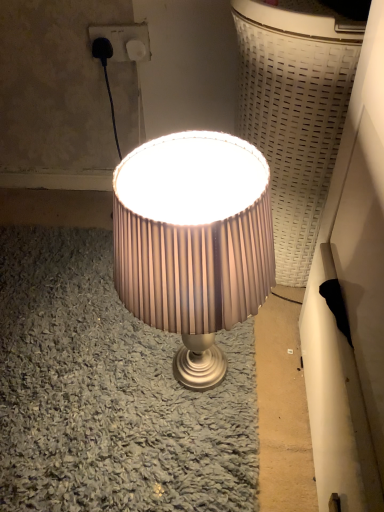
The height and width of the screenshot is (512, 384). What do you see at coordinates (124, 41) in the screenshot? I see `white plastic socket at upper center` at bounding box center [124, 41].

Locate an element on the screen. This screenshot has height=512, width=384. white plastic socket at upper center is located at coordinates (124, 41).

Identify the location of matte beige lampshade at center. The width and height of the screenshot is (384, 512). (193, 242).

This screenshot has height=512, width=384. Describe the element at coordinates (193, 242) in the screenshot. I see `matte beige lampshade at center` at that location.

What are the coordinates of `white plastic socket at upper center` in the screenshot? It's located at (124, 41).

Does white plastic socket at upper center appear on the left side of matte beige lampshade at center?

Indeed, white plastic socket at upper center is positioned on the left side of matte beige lampshade at center.

Which object is further away from the camera, white plastic socket at upper center or matte beige lampshade at center?

white plastic socket at upper center is further from the camera.

Considering the positions of point (130, 51) and point (244, 227), is point (130, 51) closer or farther from the camera than point (244, 227)?

Point (130, 51) is positioned farther from the camera compared to point (244, 227).

From the image's perspective, relative to matte beige lampshade at center, is white plastic socket at upper center above or below?

white plastic socket at upper center is situated higher than matte beige lampshade at center in the image.

From a real-world perspective, which object stands above the other?

In real-world perspective, white plastic socket at upper center is above.

Which of these two, white plastic socket at upper center or matte beige lampshade at center, is wider?

matte beige lampshade at center is wider.

In terms of height, does white plastic socket at upper center look taller or shorter compared to matte beige lampshade at center?

Clearly, white plastic socket at upper center is shorter compared to matte beige lampshade at center.

Considering the sizes of objects white plastic socket at upper center and matte beige lampshade at center in the image provided, who is bigger, white plastic socket at upper center or matte beige lampshade at center?

Bigger between the two is matte beige lampshade at center.

Is white plastic socket at upper center located outside matte beige lampshade at center?

Yes, white plastic socket at upper center is located beyond the bounds of matte beige lampshade at center.

Are white plastic socket at upper center and matte beige lampshade at center beside each other?

No.

Is white plastic socket at upper center positioned with its back to matte beige lampshade at center?

white plastic socket at upper center is not turned away from matte beige lampshade at center.

Measure the distance between white plastic socket at upper center and matte beige lampshade at center.

white plastic socket at upper center is 26.04 inches away from matte beige lampshade at center.

Find the location of a particular element. Image resolution: width=384 pixels, height=512 pixels. electric outlet above the matte beige lampshade at center (from the image's perspective) is located at coordinates (124, 41).

Is matte beige lampshade at center to the left or to the right of white plastic socket at upper center in the image?

Based on their positions, matte beige lampshade at center is located to the right of white plastic socket at upper center.

Which object is further away from the camera, matte beige lampshade at center or white plastic socket at upper center?

white plastic socket at upper center is behind.

Which is closer, (246, 149) or (139, 42)?

Clearly, point (246, 149) is closer to the camera than point (139, 42).

From the image's perspective, is matte beige lampshade at center below white plastic socket at upper center?

Indeed, from the image's perspective, matte beige lampshade at center is shown beneath white plastic socket at upper center.

From a real-world perspective, is matte beige lampshade at center positioned above or below white plastic socket at upper center?

From a real-world perspective, matte beige lampshade at center is physically below white plastic socket at upper center.

Which object is thinner, matte beige lampshade at center or white plastic socket at upper center?

With smaller width is white plastic socket at upper center.

Considering the relative sizes of matte beige lampshade at center and white plastic socket at upper center in the image provided, is matte beige lampshade at center taller than white plastic socket at upper center?

Indeed, matte beige lampshade at center has a greater height compared to white plastic socket at upper center.

Does matte beige lampshade at center have a smaller size compared to white plastic socket at upper center?

No.

Is matte beige lampshade at center located outside white plastic socket at upper center?

Absolutely, matte beige lampshade at center is external to white plastic socket at upper center.

Are matte beige lampshade at center and white plastic socket at upper center located far from each other?

matte beige lampshade at center is actually quite close to white plastic socket at upper center.

Is matte beige lampshade at center facing away from white plastic socket at upper center?

matte beige lampshade at center does not have its back to white plastic socket at upper center.

The image size is (384, 512). Find the location of `lamp directly beneath the white plastic socket at upper center (from a real-world perspective)`. lamp directly beneath the white plastic socket at upper center (from a real-world perspective) is located at coordinates click(x=193, y=242).

Find the location of `electric outlet located above the matte beige lampshade at center (from a real-world perspective)`. electric outlet located above the matte beige lampshade at center (from a real-world perspective) is located at coordinates 124,41.

I want to click on lamp in front of the white plastic socket at upper center, so click(193, 242).